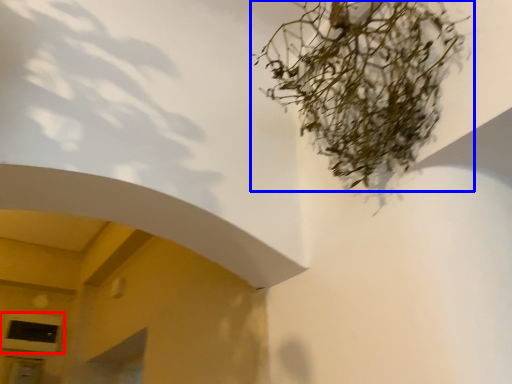
Question: Which object appears closest to the camera in this image, window (highlighted by a red box) or houseplant (highlighted by a blue box)?

Choices:
 (A) window
 (B) houseplant

Answer: (B)